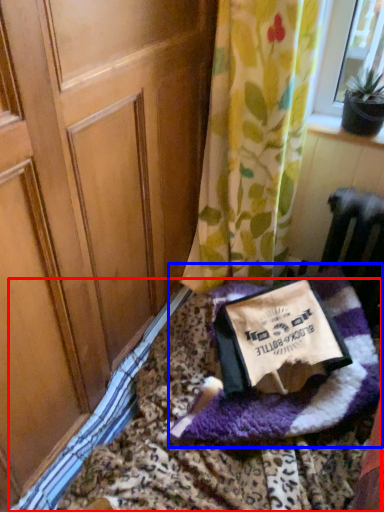
Question: Which point is closer to the camera, bedding (highlighted by a red box) or blanket (highlighted by a blue box)?

Choices:
 (A) bedding
 (B) blanket

Answer: (A)